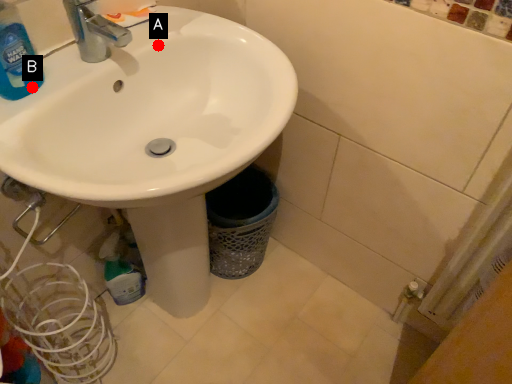
Question: Two points are circled on the image, labeled by A and B beside each circle. Which point is further to the camera?

Choices:
 (A) A is further
 (B) B is further

Answer: (A)